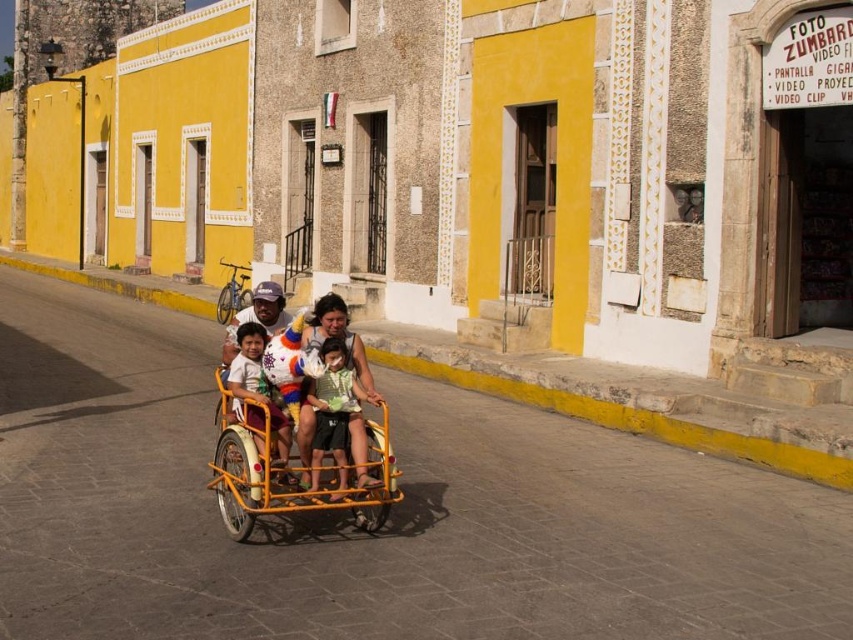
Question: In this image, where is yellow metallic tricycle at center located relative to light brown wooden cart at center?

Choices:
 (A) above
 (B) below

Answer: (A)

Question: Estimate the real-world distances between objects in this image. Which object is farther from the yellow matte wagon at center?

Choices:
 (A) matte green shirt at center
 (B) yellow metallic tricycle at center
 (C) light brown wooden cart at center

Answer: (B)

Question: Can you confirm if yellow matte wagon at center is thinner than matte green shirt at center?

Choices:
 (A) yes
 (B) no

Answer: (B)

Question: Among these points, which one is farthest from the camera?

Choices:
 (A) (x=346, y=387)
 (B) (x=347, y=337)

Answer: (B)

Question: Among these points, which one is farthest from the camera?

Choices:
 (A) (323, 396)
 (B) (274, 433)

Answer: (A)

Question: Does yellow matte wagon at center appear on the right side of light brown wooden cart at center?

Choices:
 (A) no
 (B) yes

Answer: (B)